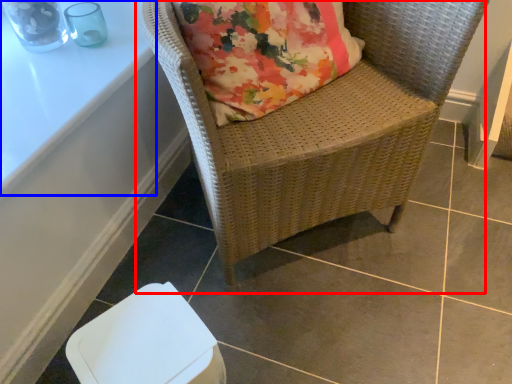
Question: Which object appears farthest to the camera in this image, chair (highlighted by a red box) or table (highlighted by a blue box)?

Choices:
 (A) chair
 (B) table

Answer: (B)